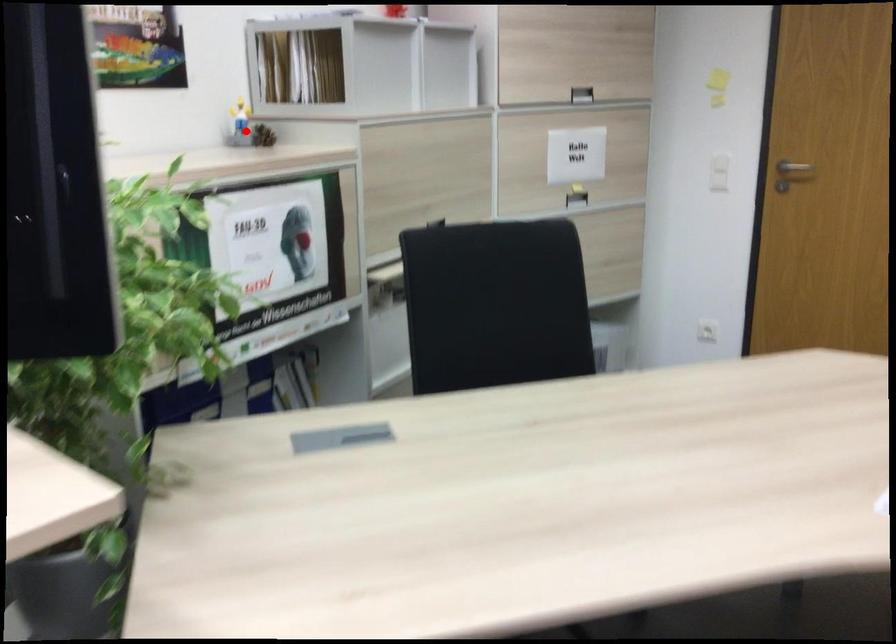
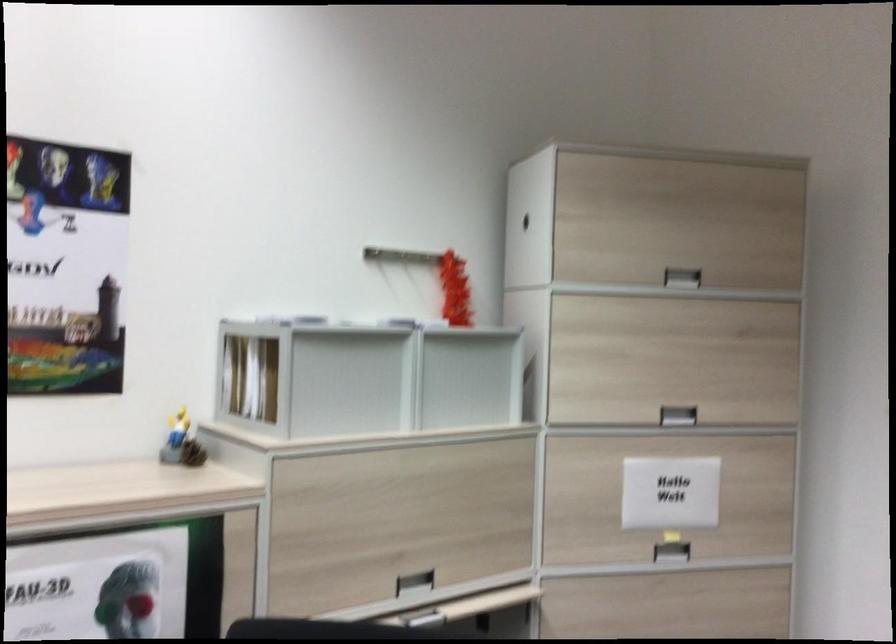
Question: I am providing you with two images of the same scene from different viewpoints. Given a red point in image1, look at the same physical point in image2. Is it:

Choices:
 (A) Closer to the viewpoint
 (B) Farther from the viewpoint

Answer: (A)